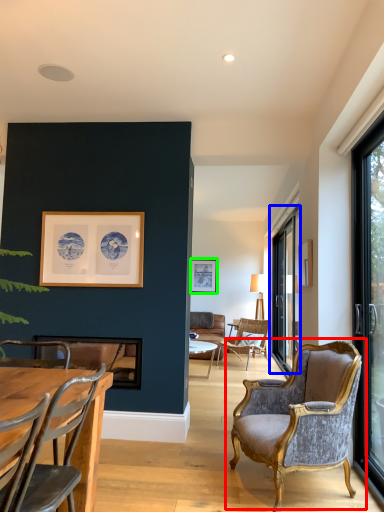
Question: Based on their relative distances, which object is nearer to chair (highlighted by a red box)? Choose from window (highlighted by a blue box) and picture frame (highlighted by a green box).

Choices:
 (A) window
 (B) picture frame

Answer: (A)